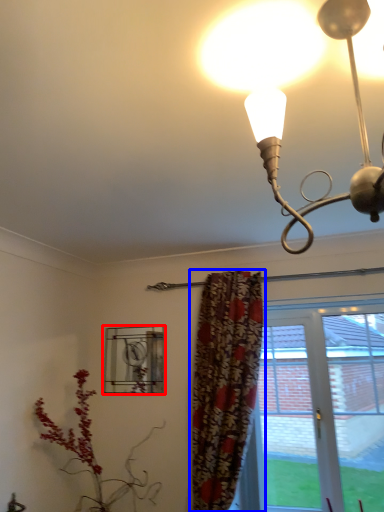
Question: Which of the following is the closest to the observer, window (highlighted by a red box) or curtain (highlighted by a blue box)?

Choices:
 (A) window
 (B) curtain

Answer: (B)